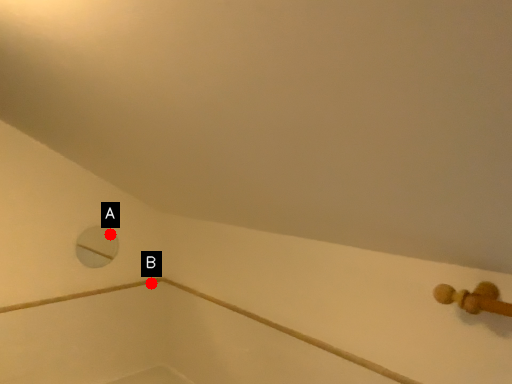
Question: Two points are circled on the image, labeled by A and B beside each circle. Among these points, which one is farthest from the camera?

Choices:
 (A) A is further
 (B) B is further

Answer: (B)